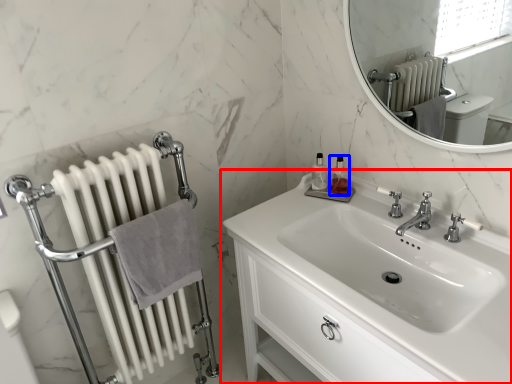
Question: Which point is further to the camera, sink (highlighted by a red box) or toiletry (highlighted by a blue box)?

Choices:
 (A) sink
 (B) toiletry

Answer: (B)